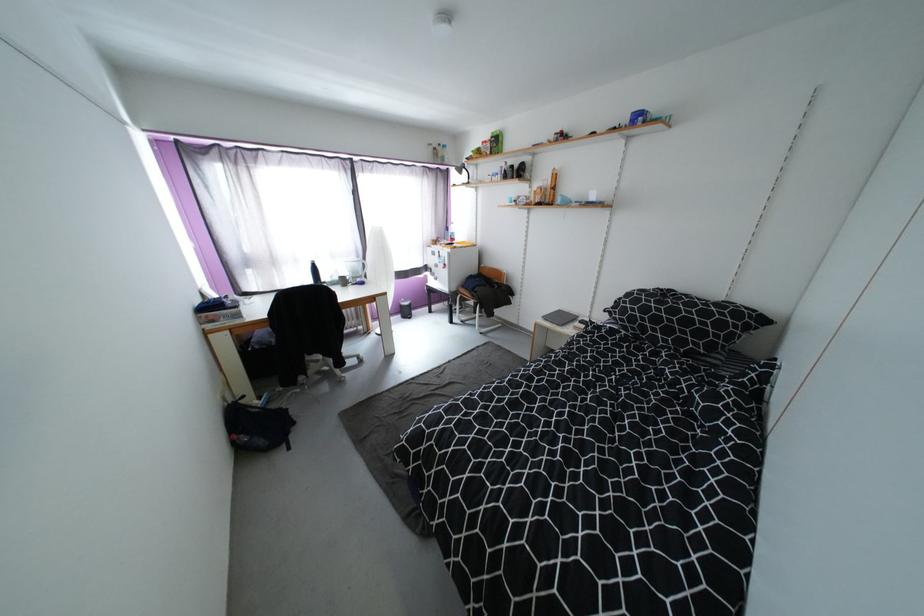
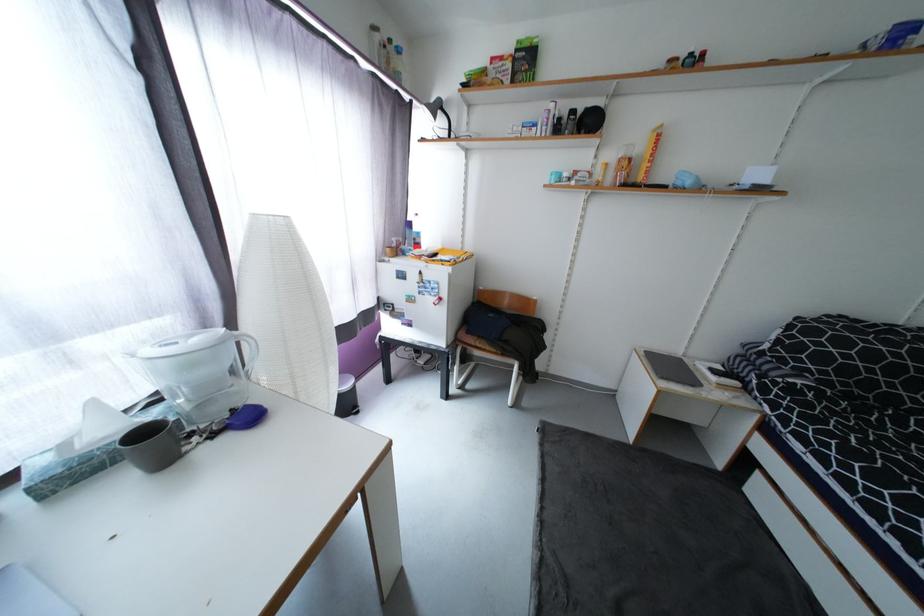
Locate, in the second image, the point that corresponds to point 460,249 in the first image.

(460, 264)